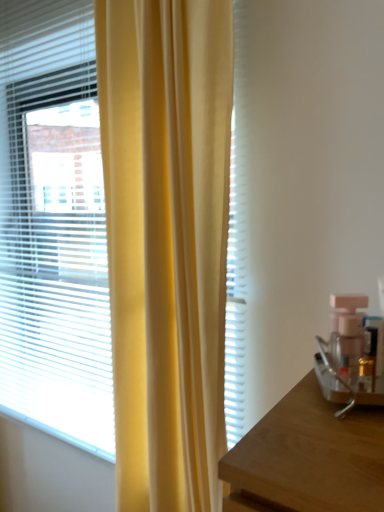
You are a GUI agent. You are given a task and a screenshot of the screen. Output one action in this format:
    pyautogui.click(x=<x>, y=<y>)
    Task: Click on the yellow silky curtain at left
    
    Given the screenshot: What is the action you would take?
    click(x=167, y=242)

The width and height of the screenshot is (384, 512). Describe the element at coordinates (167, 242) in the screenshot. I see `yellow silky curtain at left` at that location.

Locate an element on the screen. yellow silky curtain at left is located at coordinates (167, 242).